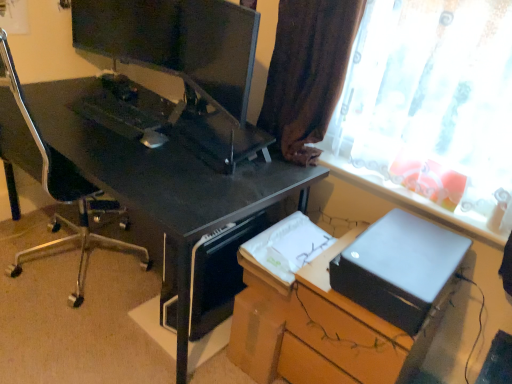
Question: Is black plastic computer tower at lower center to the left or to the right of black glossy desk at center in the image?

Choices:
 (A) right
 (B) left

Answer: (A)

Question: Is black plastic computer tower at lower center inside the boundaries of black glossy desk at center, or outside?

Choices:
 (A) inside
 (B) outside

Answer: (A)

Question: Estimate the real-world distances between objects in this image. Which object is closer to the satin black printer at lower right?

Choices:
 (A) translucent fabric curtain at upper right
 (B) black glossy desk at center
 (C) brown fabric curtain at upper right
 (D) matte black monitor at upper center
 (E) matte black printer at right

Answer: (E)

Question: Estimate the real-world distances between objects in this image. Which object is farther from the matte black monitor at upper center?

Choices:
 (A) translucent fabric curtain at upper right
 (B) satin black printer at lower right
 (C) black glossy desk at center
 (D) black plastic computer tower at lower center
 (E) matte black printer at right

Answer: (E)